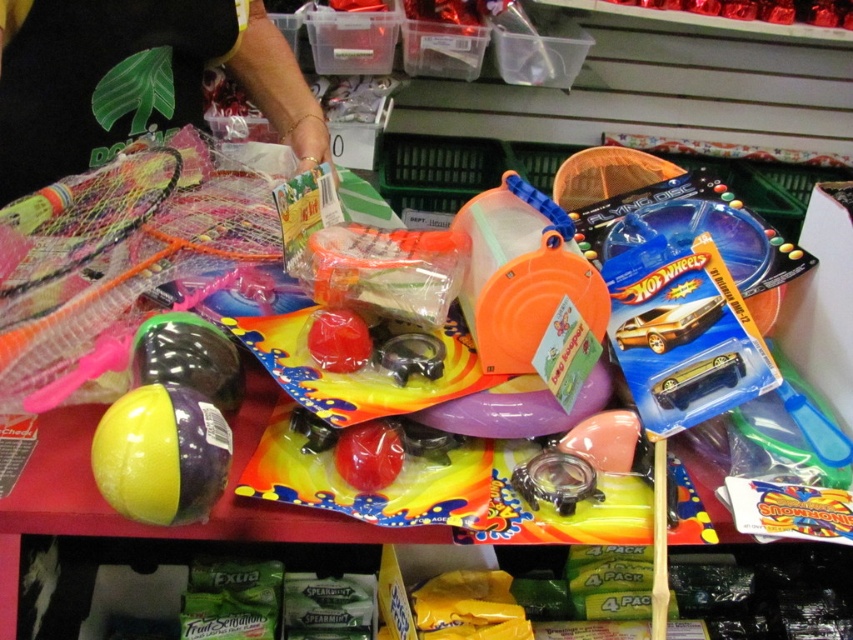
Question: Which point is closer to the camera taking this photo?

Choices:
 (A) (277, 122)
 (B) (122, 490)
 (C) (36, 276)

Answer: (B)

Question: In this image, where is black mesh netting at left located relative to multicolored mesh tennis racket at left?

Choices:
 (A) below
 (B) above

Answer: (B)

Question: Which of the following is the farthest from the observer?

Choices:
 (A) (22, 150)
 (B) (164, 506)

Answer: (A)

Question: Can you confirm if black mesh netting at left is wider than multicolored mesh tennis racket at left?

Choices:
 (A) no
 (B) yes

Answer: (B)

Question: Does black mesh netting at left appear under yellow rubber ball at lower left?

Choices:
 (A) no
 (B) yes

Answer: (A)

Question: Which object is farther from the camera taking this photo?

Choices:
 (A) black mesh netting at left
 (B) multicolored mesh tennis racket at left

Answer: (A)